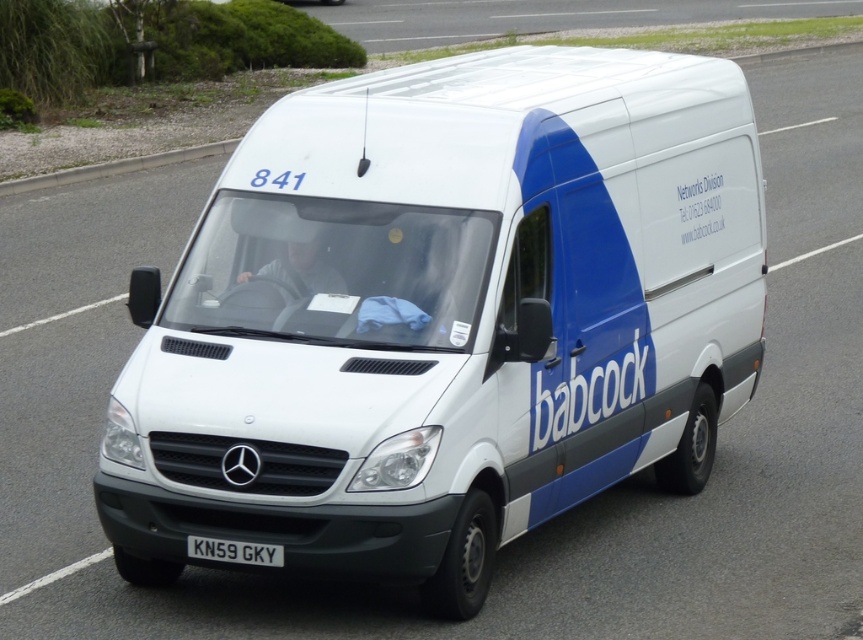
Find the location of `white matte van at center`. white matte van at center is located at coordinates (444, 316).

Who is positioned more to the right, white matte van at center or white metallic license plate at center?

From the viewer's perspective, white matte van at center appears more on the right side.

This screenshot has width=863, height=640. What do you see at coordinates (444, 316) in the screenshot?
I see `white matte van at center` at bounding box center [444, 316].

You are a GUI agent. You are given a task and a screenshot of the screen. Output one action in this format:
    pyautogui.click(x=<x>, y=<y>)
    Task: Click on the white matte van at center
    
    Given the screenshot: What is the action you would take?
    pyautogui.click(x=444, y=316)